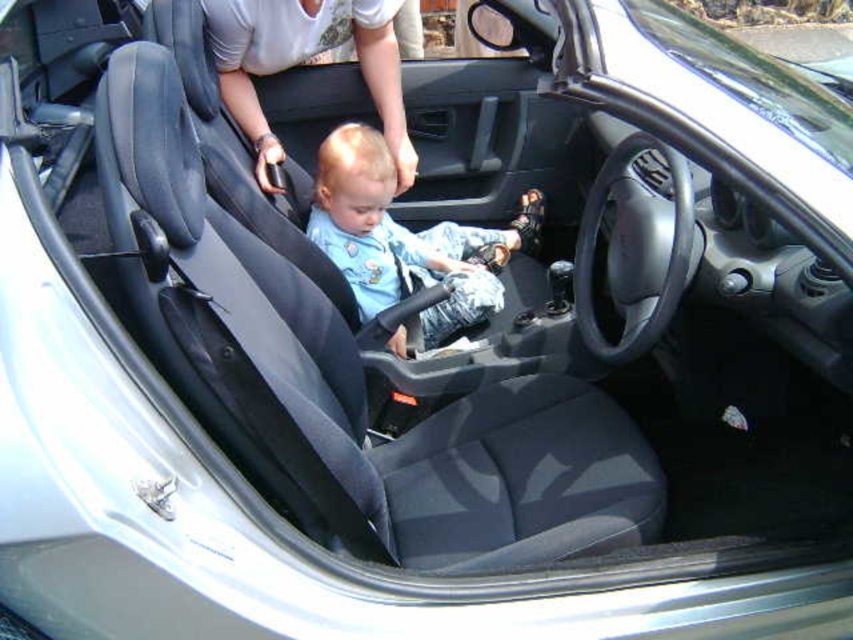
Question: Does matte blue shirt at center have a smaller size compared to white fabric shirt at upper center?

Choices:
 (A) no
 (B) yes

Answer: (A)

Question: Can you confirm if matte blue shirt at center is thinner than white fabric shirt at upper center?

Choices:
 (A) no
 (B) yes

Answer: (A)

Question: Can you confirm if matte blue shirt at center is positioned below white fabric shirt at upper center?

Choices:
 (A) yes
 (B) no

Answer: (A)

Question: Which point is farther to the camera?

Choices:
 (A) matte blue shirt at center
 (B) white fabric shirt at upper center

Answer: (A)